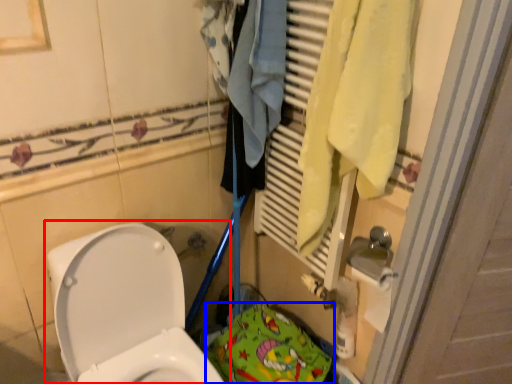
Question: Among these objects, which one is nearest to the camera, toilet (highlighted by a red box) or material (highlighted by a blue box)?

Choices:
 (A) toilet
 (B) material

Answer: (A)